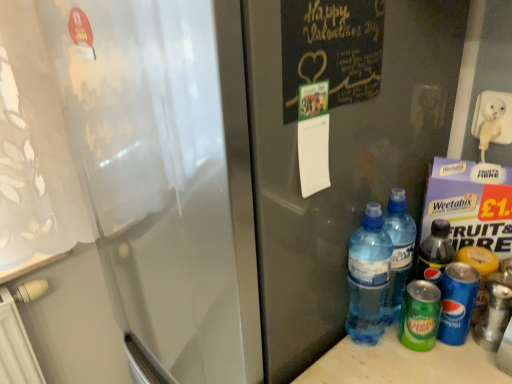
Question: From a real-world perspective, is translucent plastic water bottles at lower right, the third bottle in the right-to-left sequence, physically located above or below blue plastic bottle at lower right, placed as the 1th bottle when sorted from right to left?

Choices:
 (A) below
 (B) above

Answer: (B)

Question: Is translucent plastic water bottles at lower right, the third bottle in the right-to-left sequence, spatially inside blue plastic bottle at lower right, which is counted as the 3th bottle, starting from the left, or outside of it?

Choices:
 (A) outside
 (B) inside

Answer: (A)

Question: Which is farther from the translucent plastic water bottles at lower right, the first bottle when ordered from left to right?

Choices:
 (A) black chalkboard at upper right
 (B) green matte can at lower right, the second bottle in the left-to-right sequence
 (C) blue plastic bottle at lower right, placed as the 1th bottle when sorted from right to left

Answer: (A)

Question: Considering the real-world distances, which object is farthest from the translucent plastic water bottles at lower right, the third bottle in the right-to-left sequence?

Choices:
 (A) blue plastic bottle at lower right, placed as the 1th bottle when sorted from right to left
 (B) green matte can at lower right, the second bottle in the left-to-right sequence
 (C) black chalkboard at upper right

Answer: (C)